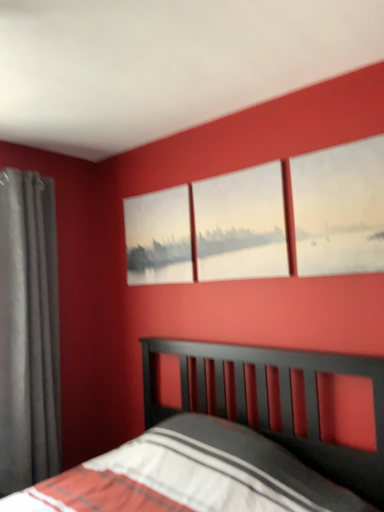
Question: Is matte gray curtain at left completely or partially inside matte canvas painting at upper right, arranged as the second window when viewed from the back?

Choices:
 (A) no
 (B) yes

Answer: (A)

Question: Is matte canvas painting at upper right, acting as the first window starting from the right, at the left side of matte gray curtain at left?

Choices:
 (A) no
 (B) yes

Answer: (A)

Question: Can you confirm if matte canvas painting at upper right, arranged as the second window when viewed from the back, is positioned to the right of matte gray curtain at left?

Choices:
 (A) yes
 (B) no

Answer: (A)

Question: Is matte canvas painting at upper right, positioned as the 1th window in front-to-back order, looking in the opposite direction of matte gray curtain at left?

Choices:
 (A) no
 (B) yes

Answer: (A)

Question: Are matte canvas painting at upper right, positioned as the 2th window in left-to-right order, and matte gray curtain at left located far from each other?

Choices:
 (A) no
 (B) yes

Answer: (B)

Question: From the image's perspective, is matte canvas painting at upper right, positioned as the 1th window in front-to-back order, located beneath matte gray curtain at left?

Choices:
 (A) no
 (B) yes

Answer: (A)

Question: From the image's perspective, is matte gray curtain at left under matte canvas painting at center?

Choices:
 (A) no
 (B) yes

Answer: (B)

Question: Is matte canvas painting at center surrounded by matte gray curtain at left?

Choices:
 (A) yes
 (B) no

Answer: (B)

Question: Considering the relative positions of matte gray curtain at left and matte canvas painting at center in the image provided, is matte gray curtain at left behind matte canvas painting at center?

Choices:
 (A) yes
 (B) no

Answer: (B)

Question: Is matte gray curtain at left located outside matte canvas painting at center?

Choices:
 (A) no
 (B) yes

Answer: (B)

Question: From a real-world perspective, does matte gray curtain at left sit lower than matte canvas painting at center?

Choices:
 (A) no
 (B) yes

Answer: (B)

Question: Does matte gray curtain at left have a larger size compared to matte canvas painting at center?

Choices:
 (A) yes
 (B) no

Answer: (A)

Question: Is white matte painting at center, which appears as the 2th window when viewed from the front, closer to the viewer compared to matte canvas painting at upper right, positioned as the 1th window in front-to-back order?

Choices:
 (A) no
 (B) yes

Answer: (A)